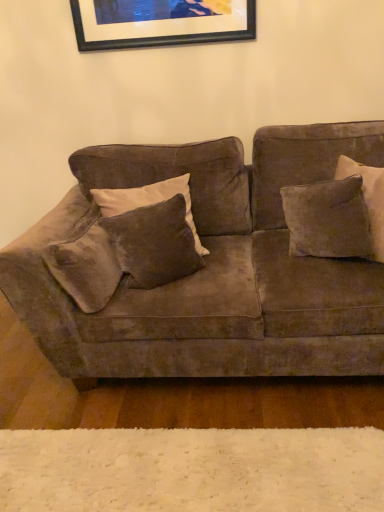
Question: In terms of width, does velvet brown pillow at center, the first pillow positioned from the left, look wider or thinner when compared to black matte picture frame at upper center?

Choices:
 (A) thin
 (B) wide

Answer: (B)

Question: Would you say velvet brown pillow at center, positioned as the 2th pillow in right-to-left order, is to the left or to the right of black matte picture frame at upper center in the picture?

Choices:
 (A) right
 (B) left

Answer: (B)

Question: Considering the real-world distances, which object is farthest from the velvet brown pillow at center, the first pillow positioned from the left?

Choices:
 (A) white fluffy rug at lower center
 (B) velvet brown couch at center
 (C) black matte picture frame at upper center
 (D) velvet brown pillow at right, which is the first pillow in right-to-left order

Answer: (A)

Question: Which is nearer to the white fluffy rug at lower center?

Choices:
 (A) black matte picture frame at upper center
 (B) velvet brown pillow at center, the first pillow positioned from the left
 (C) velvet brown couch at center
 (D) velvet brown pillow at right, the 2th pillow when ordered from left to right

Answer: (C)